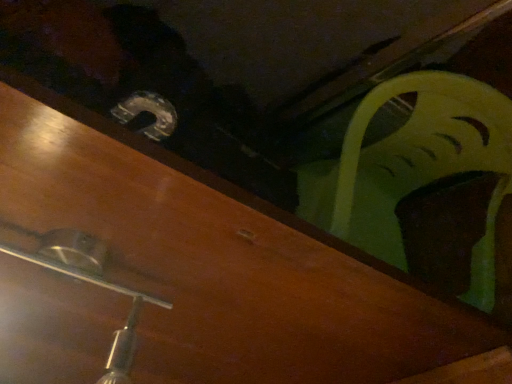
Question: Should I look upward or downward to see metallic silver light fixture at lower left?

Choices:
 (A) down
 (B) up

Answer: (A)